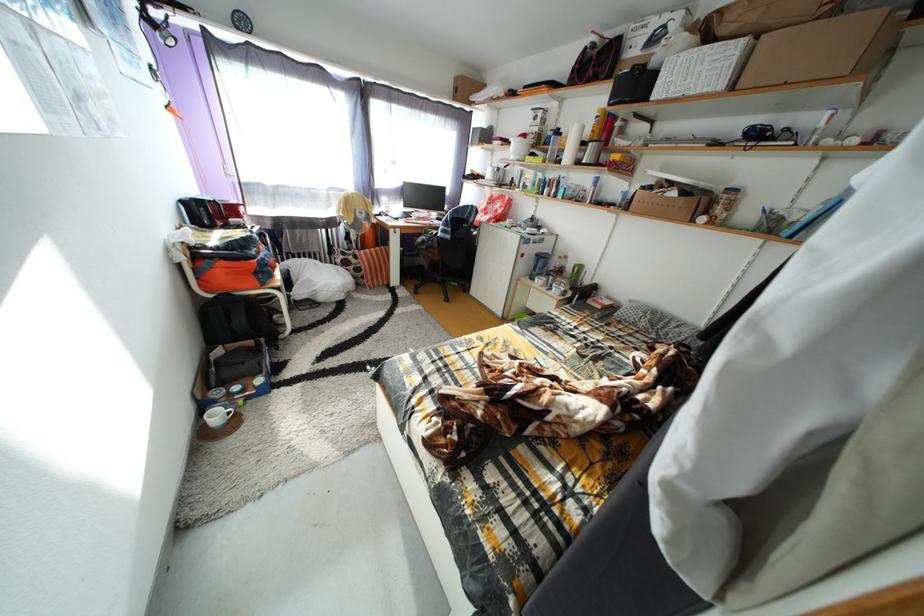
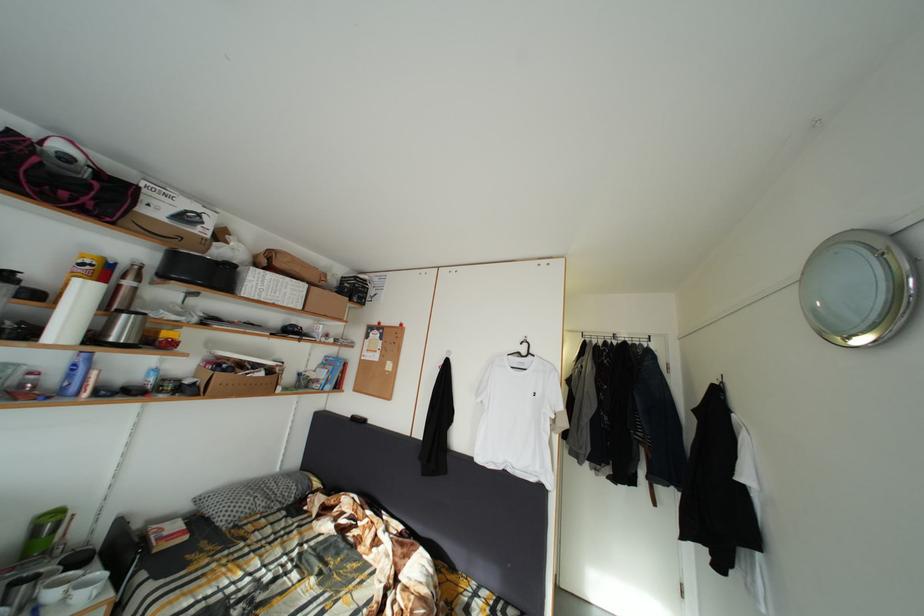
The point at (x=592, y=168) is marked in the first image. Where is the corresponding point in the second image?

(120, 345)